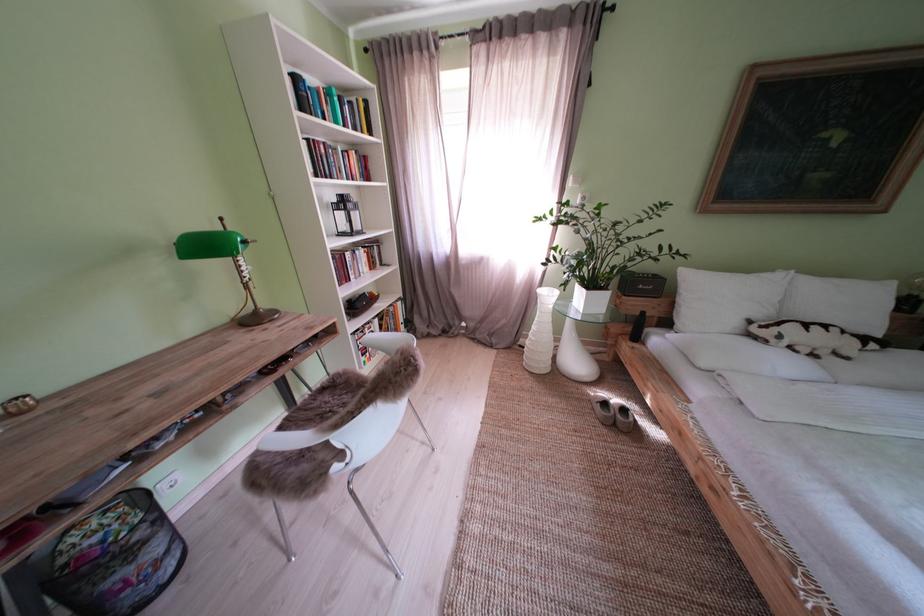
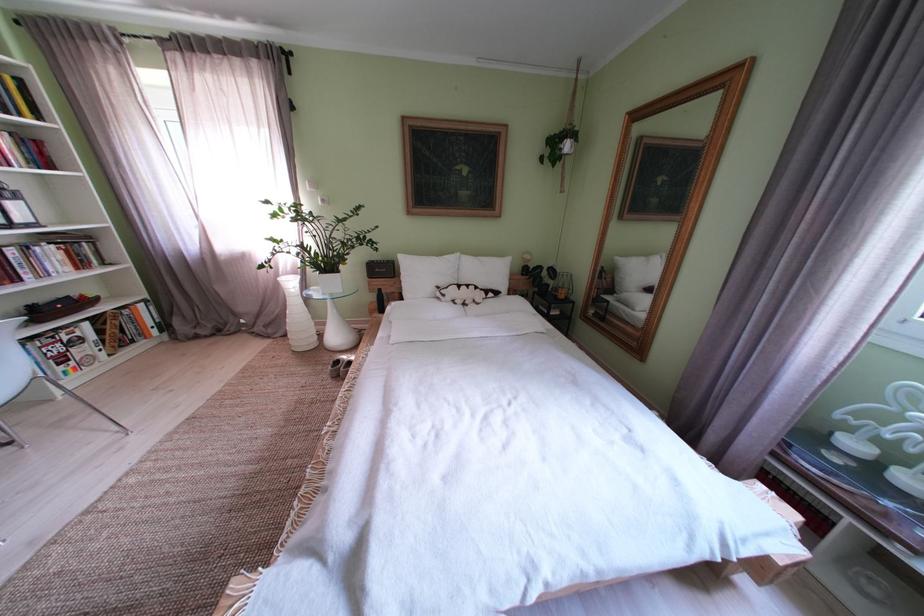
Where in the second image is the point corresponding to (847,286) from the first image?

(492, 264)